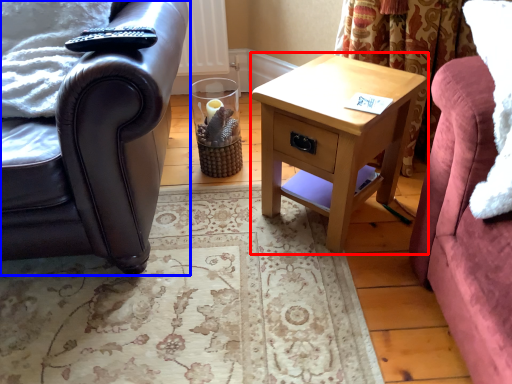
Question: Which point is further to the camera, nightstand (highlighted by a red box) or chair (highlighted by a blue box)?

Choices:
 (A) nightstand
 (B) chair

Answer: (A)